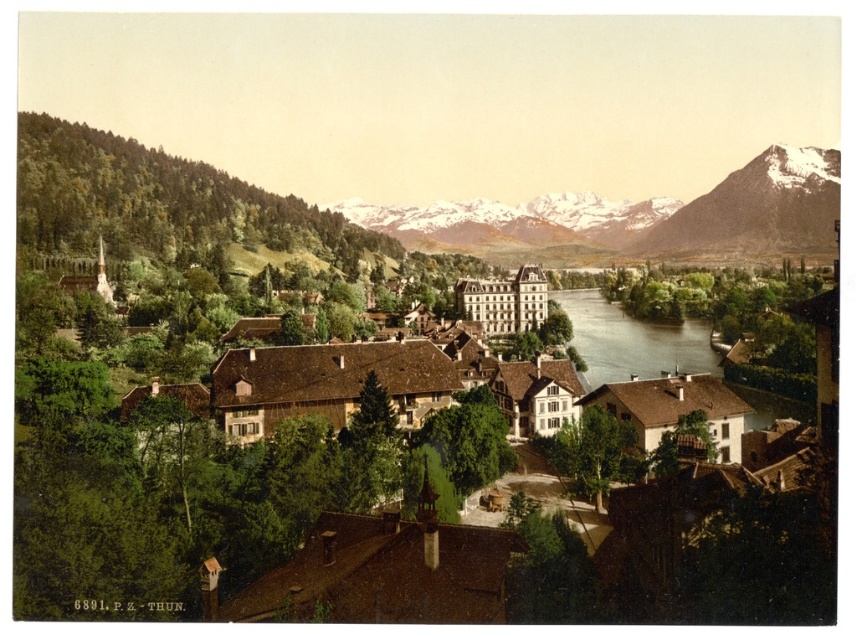
You are an architect planning to build a new observation deck in the town. You want to ensure it offers the best view of both the snowy granite mountain at upper center and the snowy granite mountain at upper right. Based on their sizes, which mountain should you prioritize placing closer to the deck to ensure it doesn t block the view of the other?

The snowy granite mountain at upper center is wider than the snowy granite mountain at upper right. To prevent blocking the view of the smaller mountain, the observation deck should be positioned closer to the snowy granite mountain at upper right since it is narrower and less likely to obstruct the larger one.

You are standing in the town square and see two points marked in the scene. The first point is at coordinate point (778, 157) and the second is at point (568, 317). Which point is closer to you?

Point (778, 157) is closer to you because it is further to the viewer than point (568, 317).

Based on the scene description, where is the snowy granite mountain at upper center located in terms of 2D coordinates?

The snowy granite mountain at upper center is located at the 2D coordinates point (638,218).